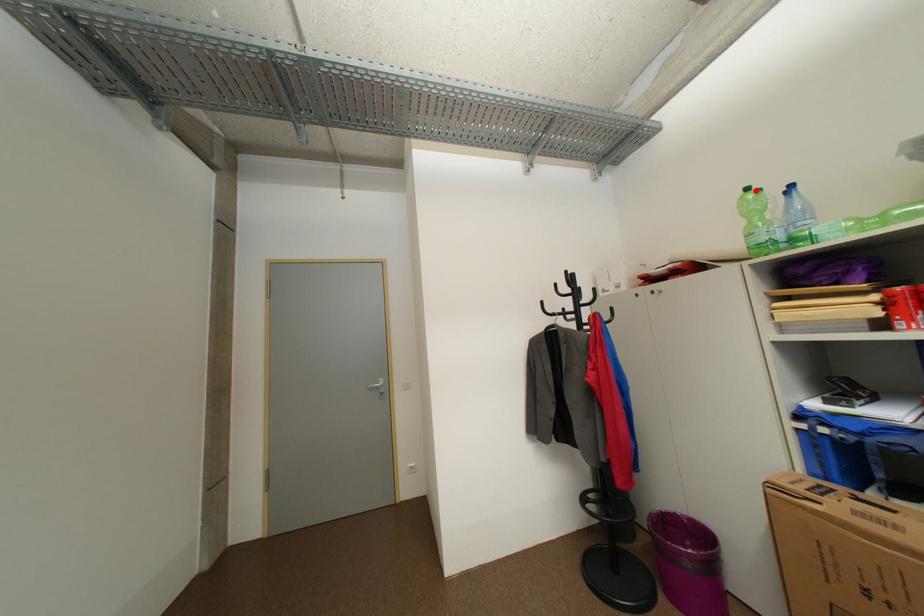
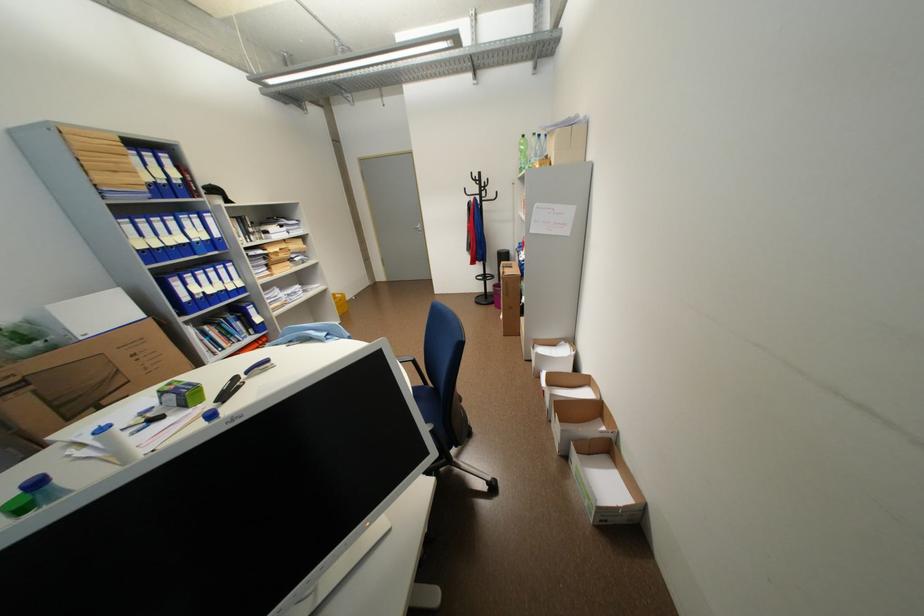
Question: A red point is marked in image1. In image2, is the corresponding 3D point closer to the camera or farther? Reply with the corresponding letter.

Choices:
 (A) The corresponding 3D point is closer.
 (B) The corresponding 3D point is farther.

Answer: (A)